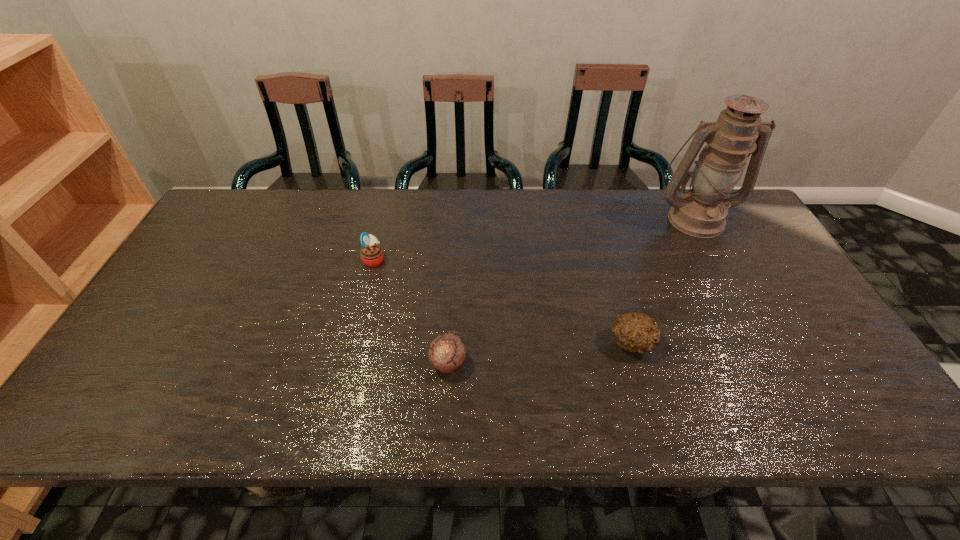
Locate an element on the screen. This screenshot has width=960, height=540. object positioned at the far edge is located at coordinates (701, 212).

Where is `object situated at the right edge`? The width and height of the screenshot is (960, 540). object situated at the right edge is located at coordinates (701, 212).

The height and width of the screenshot is (540, 960). Identify the location of object situated at the far right corner. (701, 212).

This screenshot has width=960, height=540. In the image, there is a desktop. Identify the location of vacant space at the far edge. (262, 229).

In the image, there is a desktop. Where is `vacant space at the near edge`? Image resolution: width=960 pixels, height=540 pixels. vacant space at the near edge is located at coordinates (724, 413).

The height and width of the screenshot is (540, 960). Find the location of `vacant space at the left edge of the desktop`. vacant space at the left edge of the desktop is located at coordinates (210, 264).

The image size is (960, 540). I want to click on free spot at the far left corner of the desktop, so click(235, 196).

This screenshot has height=540, width=960. Find the location of `empty location between the farthest muffin and the second object from left to right`. empty location between the farthest muffin and the second object from left to right is located at coordinates pos(411,312).

The image size is (960, 540). What are the coordinates of `vacant area that lies between the rightmost muffin and the second muffin from left to right` in the screenshot? It's located at 540,353.

This screenshot has width=960, height=540. What are the coordinates of `free spot between the farthest object and the rightmost muffin` in the screenshot? It's located at (663, 281).